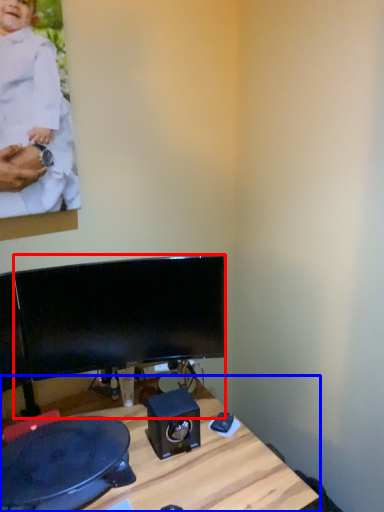
Question: Which point is closer to the camera, computer monitor (highlighted by a red box) or desk (highlighted by a blue box)?

Choices:
 (A) computer monitor
 (B) desk

Answer: (B)